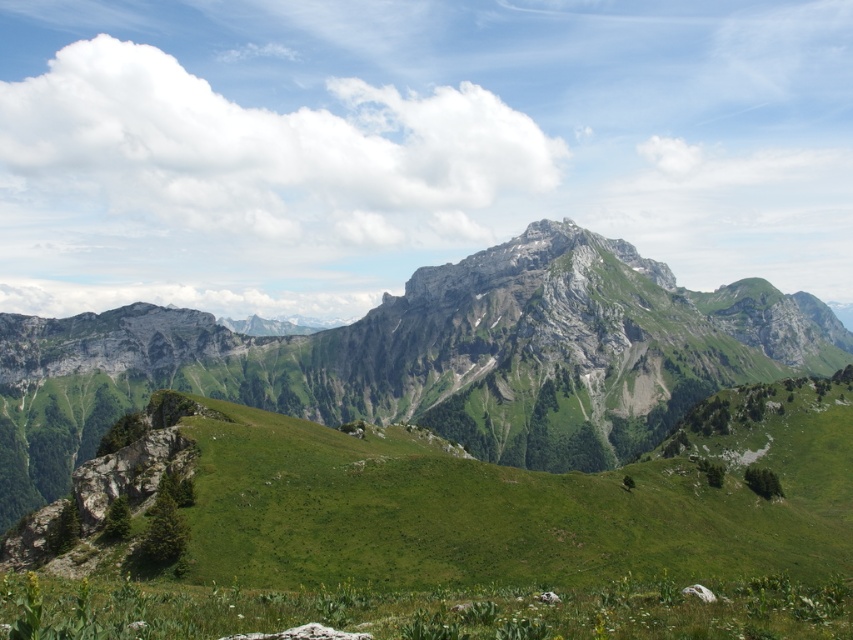
You are hiking and want to take a photo of the green grassy mountain at center and the green grassy at lower left. Which one should you frame first in your camera viewfinder to capture both in the same shot?

You should frame the green grassy at lower left first because the green grassy mountain at center is to the right of it, allowing you to adjust the viewfinder to include both areas in the shot.